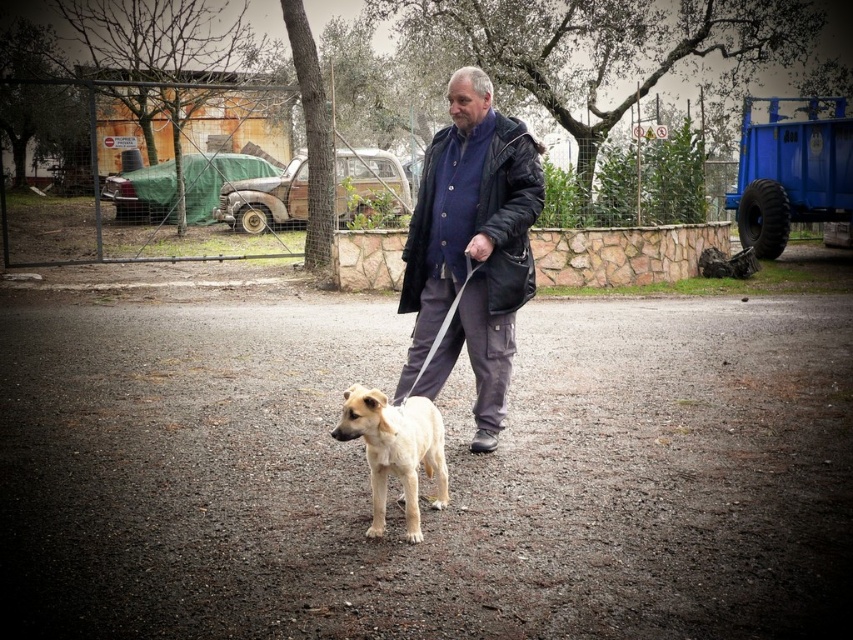
Can you confirm if dark blue jacket at center is positioned to the left of light brown fur dog at center?

No, dark blue jacket at center is not to the left of light brown fur dog at center.

Is dark blue jacket at center taller than light brown fur dog at center?

Yes, dark blue jacket at center is taller than light brown fur dog at center.

Which is in front, point (531, 262) or point (430, 502)?

Point (430, 502)

Identify the location of dark blue jacket at center. This screenshot has width=853, height=640. (x=471, y=248).